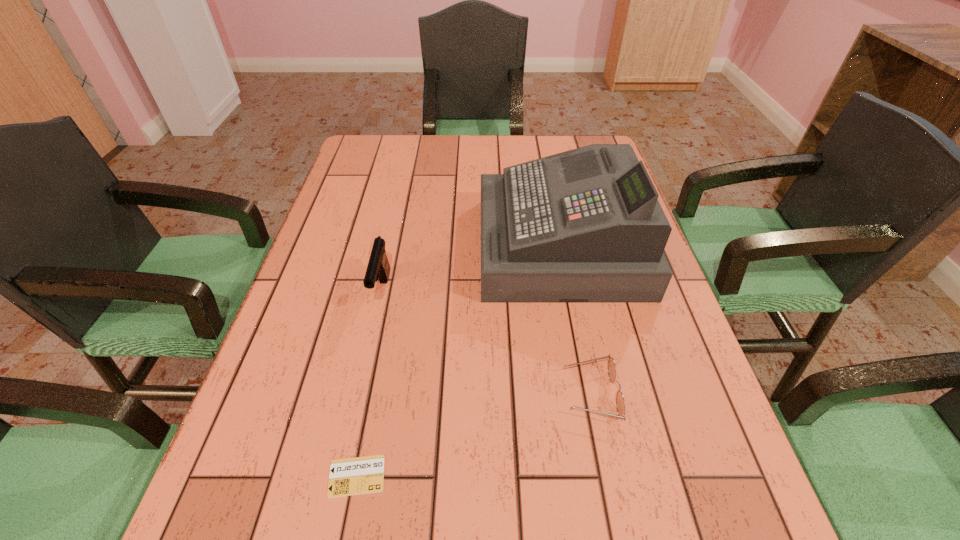
Find the location of a particular element. The image size is (960, 540). free space located 0.380m on the front-facing side of the spectacles is located at coordinates (361, 394).

Locate an element on the screen. Image resolution: width=960 pixels, height=540 pixels. vacant space located on the front-facing side of the spectacles is located at coordinates (501, 394).

You are a GUI agent. You are given a task and a screenshot of the screen. Output one action in this format:
    pyautogui.click(x=<x>, y=<y>)
    Task: Click on the vacant space located 0.170m on the front-facing side of the spectacles
    The width and height of the screenshot is (960, 540).
    Given the screenshot: What is the action you would take?
    pyautogui.click(x=474, y=394)

Identify the location of free space located 0.130m on the right of the identity card. (466, 476).

Locate an element on the screen. The height and width of the screenshot is (540, 960). object located at the right edge is located at coordinates (583, 226).

I want to click on vacant region at the far edge of the desktop, so click(x=452, y=141).

In the image, there is a desktop. Identify the location of vacant space at the near edge. The height and width of the screenshot is (540, 960). (409, 536).

Image resolution: width=960 pixels, height=540 pixels. What are the coordinates of `vacant space at the left edge of the desktop` in the screenshot? It's located at (337, 400).

The width and height of the screenshot is (960, 540). I want to click on vacant space at the right edge of the desktop, so point(647,413).

You are a GUI agent. You are given a task and a screenshot of the screen. Output one action in this format:
    pyautogui.click(x=<x>, y=<y>)
    Task: Click on the free space at the far right corner of the desktop
    
    Given the screenshot: What is the action you would take?
    pyautogui.click(x=575, y=139)